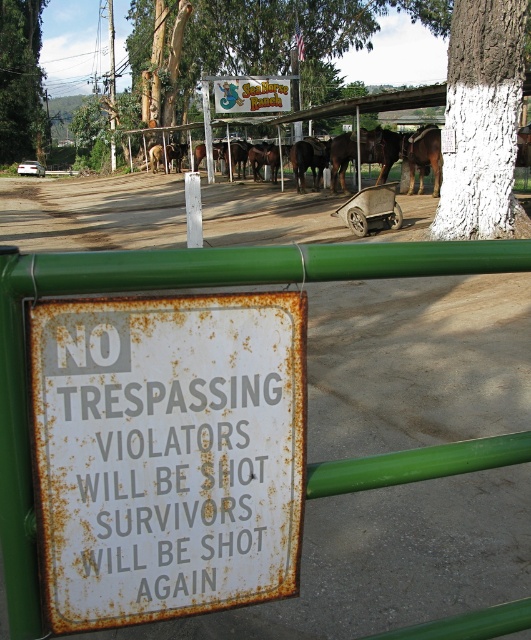
Does rusty metal sign at center have a lesser height compared to white painted bark at upper center?

Correct, rusty metal sign at center is not as tall as white painted bark at upper center.

Is point (195, 321) less distant than point (506, 112)?

Yes, it is.

Find the location of `rusty metal sign at center`. rusty metal sign at center is located at coordinates (167, 452).

The image size is (531, 640). Find the location of `rusty metal sign at center`. rusty metal sign at center is located at coordinates (167, 452).

Is rusty metal sign at center wider than green rough bark tree at upper left?

Incorrect, rusty metal sign at center's width does not surpass green rough bark tree at upper left's.

Is rusty metal sign at center smaller than green rough bark tree at upper left?

Yes, rusty metal sign at center is smaller than green rough bark tree at upper left.

Who is more forward, (174, 588) or (12, 44)?

Point (174, 588) is more forward.

Where is `rusty metal sign at center`? rusty metal sign at center is located at coordinates (167, 452).

Between white painted bark at upper center and green rough bark tree at upper left, which one is positioned lower?

white painted bark at upper center

Which is behind, point (478, 83) or point (32, 22)?

The point (32, 22) is more distant.

Who is more distant from viewer, (464,6) or (40,77)?

Positioned behind is point (40,77).

The image size is (531, 640). I want to click on white painted bark at upper center, so click(x=482, y=122).